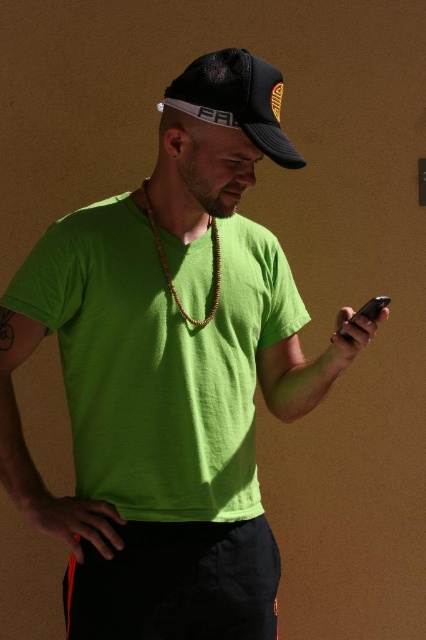
Question: Is lime green t-shirt at center positioned behind black mesh baseball cap at upper center?

Choices:
 (A) no
 (B) yes

Answer: (B)

Question: Estimate the real-world distances between objects in this image. Which object is farther from the lime green t-shirt at center?

Choices:
 (A) brown wooden necklace at center
 (B) black matte smartphone at center

Answer: (B)

Question: Which object is the farthest from the white fabric earphones at upper center?

Choices:
 (A) lime green t-shirt at center
 (B) black mesh baseball cap at upper center
 (C) brown wooden necklace at center

Answer: (A)

Question: Can you confirm if lime green t-shirt at center is thinner than white fabric earphones at upper center?

Choices:
 (A) yes
 (B) no

Answer: (B)

Question: Among these objects, which one is nearest to the camera?

Choices:
 (A) black matte smartphone at center
 (B) lime green t-shirt at center
 (C) white fabric earphones at upper center
 (D) black mesh baseball cap at upper center

Answer: (A)

Question: Is lime green t-shirt at center bigger than black mesh baseball cap at upper center?

Choices:
 (A) no
 (B) yes

Answer: (B)